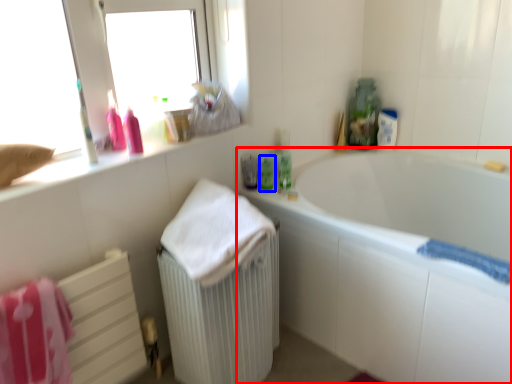
Question: Which point is closer to the camera, bathtub (highlighted by a red box) or mouthwash (highlighted by a blue box)?

Choices:
 (A) bathtub
 (B) mouthwash

Answer: (A)